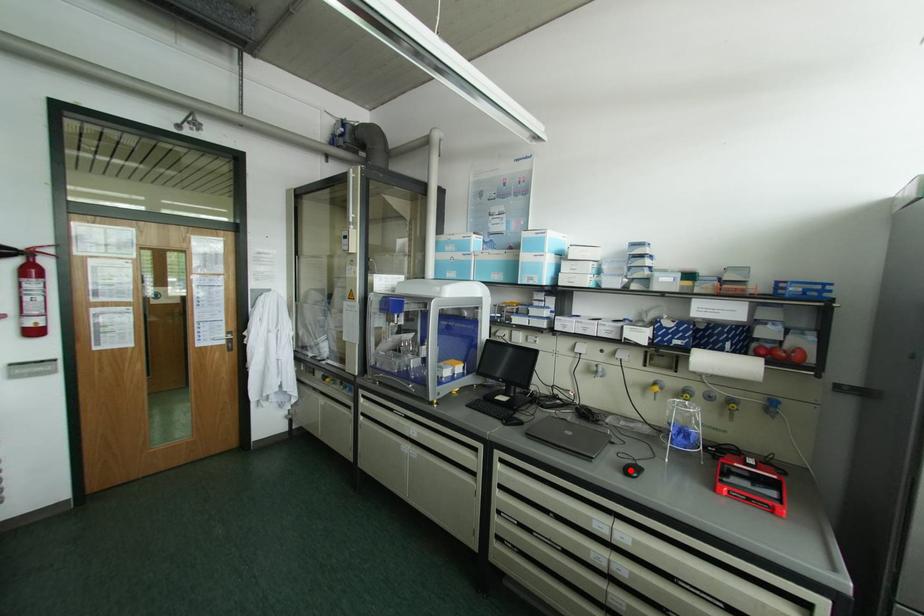
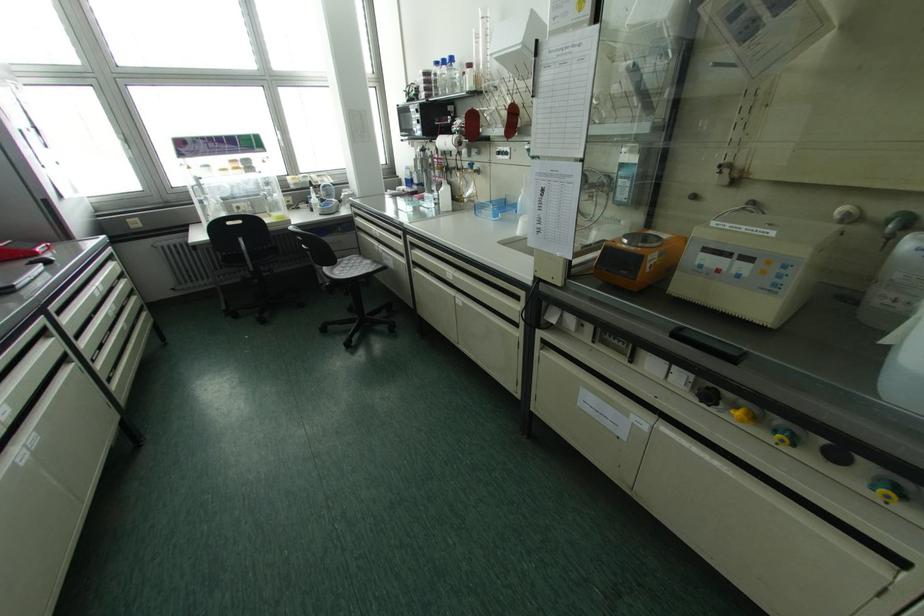
The point at the highlighted location is marked in the first image. Where is the corresponding point in the second image?

(40, 262)